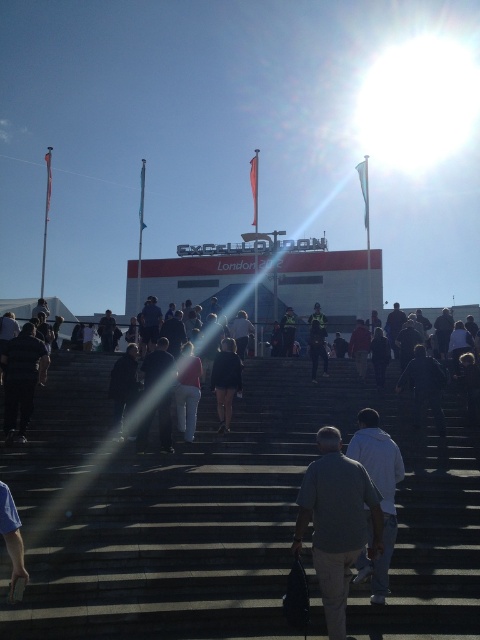
You are standing at the center of the image and want to locate the dark gray fabric jacket at lower left. According to the coordinates provided, in which direction should you look to find it?

The dark gray fabric jacket at lower left is located at coordinates point (22, 378). Since the y coordinate is 0.046, which is closer to the bottom of the image, you should look downward from the center to find it.